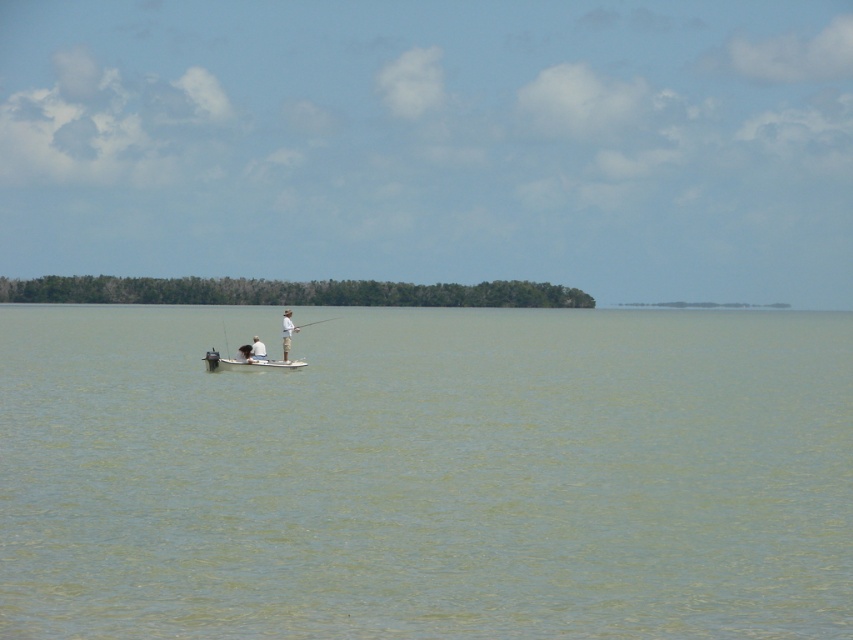
Question: Which point is farther to the camera?

Choices:
 (A) (254, 340)
 (B) (660, 632)

Answer: (A)

Question: Among these objects, which one is farthest from the camera?

Choices:
 (A) white plastic fishing rod at center
 (B) white plastic boat at center

Answer: (A)

Question: Is white matte boat at center bigger than white plastic fishing rod at center?

Choices:
 (A) no
 (B) yes

Answer: (A)

Question: Is greenish water at center to the right of white plastic boat at center from the viewer's perspective?

Choices:
 (A) no
 (B) yes

Answer: (B)

Question: Which point appears closest to the camera in this image?

Choices:
 (A) (258, 339)
 (B) (230, 368)
 (C) (283, 348)
 (D) (329, 321)

Answer: (B)

Question: Does white matte shirt at center appear over white plastic fishing rod at center?

Choices:
 (A) yes
 (B) no

Answer: (B)